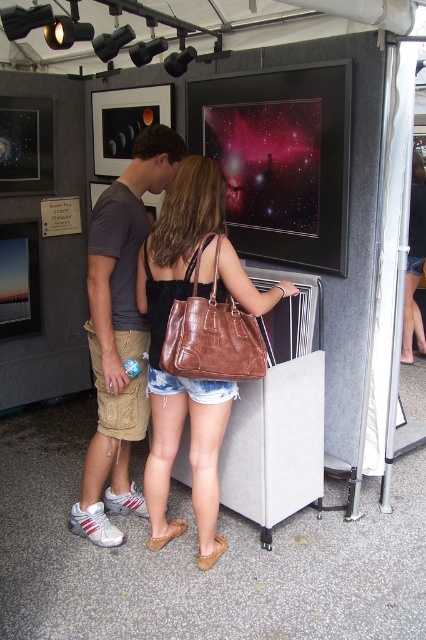
Question: Is brown leather purse at center to the left of khaki cargo shorts at center from the viewer's perspective?

Choices:
 (A) yes
 (B) no

Answer: (B)

Question: Is brown leather purse at center positioned behind khaki cargo shorts at center?

Choices:
 (A) no
 (B) yes

Answer: (A)

Question: Which object appears farthest from the camera in this image?

Choices:
 (A) khaki cargo shorts at center
 (B) brown leather purse at center

Answer: (A)

Question: Which point is closer to the camera?

Choices:
 (A) khaki cargo shorts at center
 (B) brown leather purse at center

Answer: (B)

Question: Can you confirm if brown leather purse at center is thinner than khaki cargo shorts at center?

Choices:
 (A) yes
 (B) no

Answer: (B)